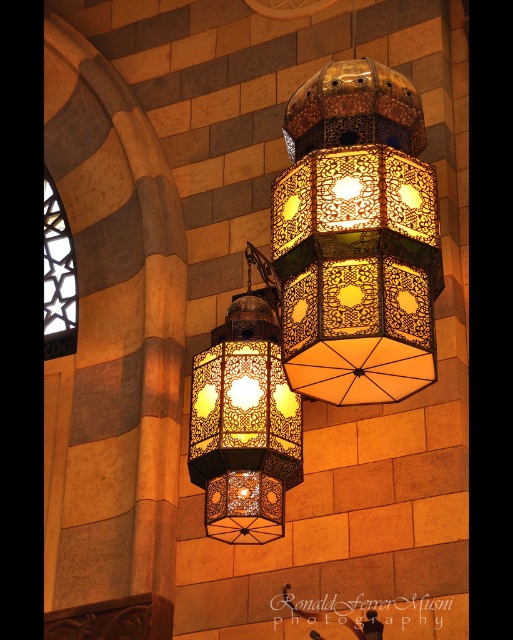
The height and width of the screenshot is (640, 513). What do you see at coordinates (357, 237) in the screenshot?
I see `golden metallic lantern at center` at bounding box center [357, 237].

Which is above, golden metallic lantern at center or matte metal lantern at center?

golden metallic lantern at center is above.

Which is in front, point (417, 236) or point (243, 387)?

Positioned in front is point (417, 236).

You are a GUI agent. You are given a task and a screenshot of the screen. Output one action in this format:
    pyautogui.click(x=<x>, y=<y>)
    Task: Click on the golden metallic lantern at center
    The width and height of the screenshot is (513, 640).
    Given the screenshot: What is the action you would take?
    pyautogui.click(x=357, y=237)